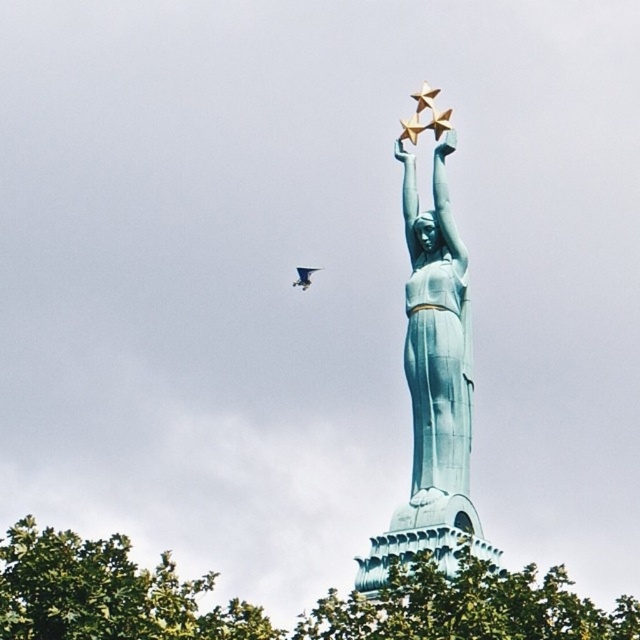
Can you confirm if green leafy tree at center is positioned above green leafy tree at lower left?

No, green leafy tree at center is not above green leafy tree at lower left.

Which is more to the right, green leafy tree at center or green leafy tree at lower left?

green leafy tree at center

The height and width of the screenshot is (640, 640). What do you see at coordinates (460, 596) in the screenshot? I see `green leafy tree at center` at bounding box center [460, 596].

The height and width of the screenshot is (640, 640). In order to click on green leafy tree at center in this screenshot , I will do `click(460, 596)`.